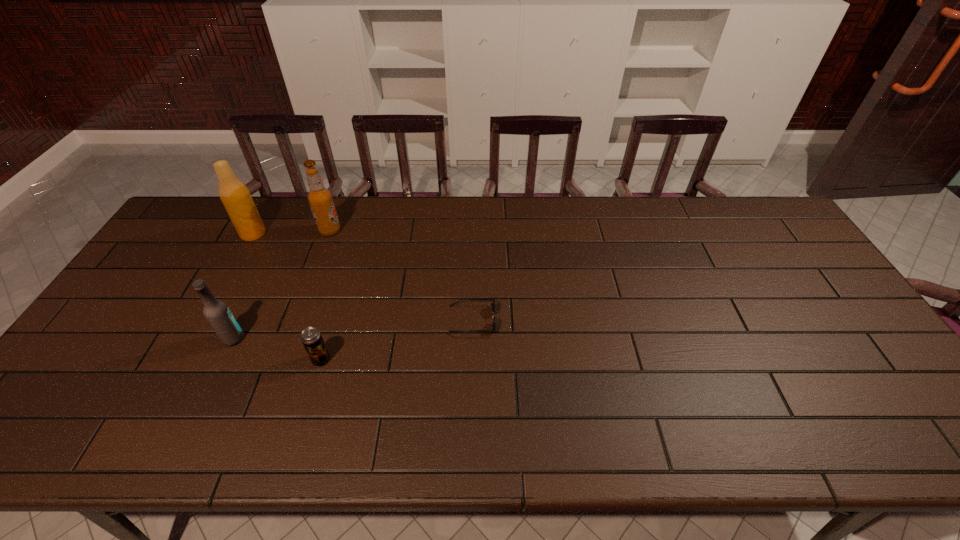
Image resolution: width=960 pixels, height=540 pixels. Find the location of `the leftmost beer bottle`. the leftmost beer bottle is located at coordinates (234, 194).

Find the location of a particular element. The width and height of the screenshot is (960, 540). the rightmost beer bottle is located at coordinates (320, 199).

Find the location of a particular element. This screenshot has width=960, height=540. the second object from left to right is located at coordinates (217, 313).

The image size is (960, 540). In order to click on the third tallest object in this screenshot , I will do `click(217, 313)`.

This screenshot has width=960, height=540. In order to click on the second shortest object in this screenshot , I will do `click(311, 338)`.

Locate an element on the screen. This screenshot has height=540, width=960. the nearest object is located at coordinates (311, 338).

At what (x,y) coordinates should I click in order to perform the action: click on the shortest object. Please return your answer as a coordinate pair (x, y). Looking at the image, I should click on (492, 304).

You are a GUI agent. You are given a task and a screenshot of the screen. Output one action in this format:
    pyautogui.click(x=<x>, y=<y>)
    Task: Click on the rightmost object
    
    Given the screenshot: What is the action you would take?
    pyautogui.click(x=492, y=304)

Identify the location of vacant area situated 0.360m on the front of the leftmost object. (200, 332).

You are a GUI agent. You are given a task and a screenshot of the screen. Output one action in this format:
    pyautogui.click(x=<x>, y=<y>)
    Task: Click on the vacant area situated 0.260m on the front label of the third object from right to left
    
    Given the screenshot: What is the action you would take?
    pyautogui.click(x=420, y=231)